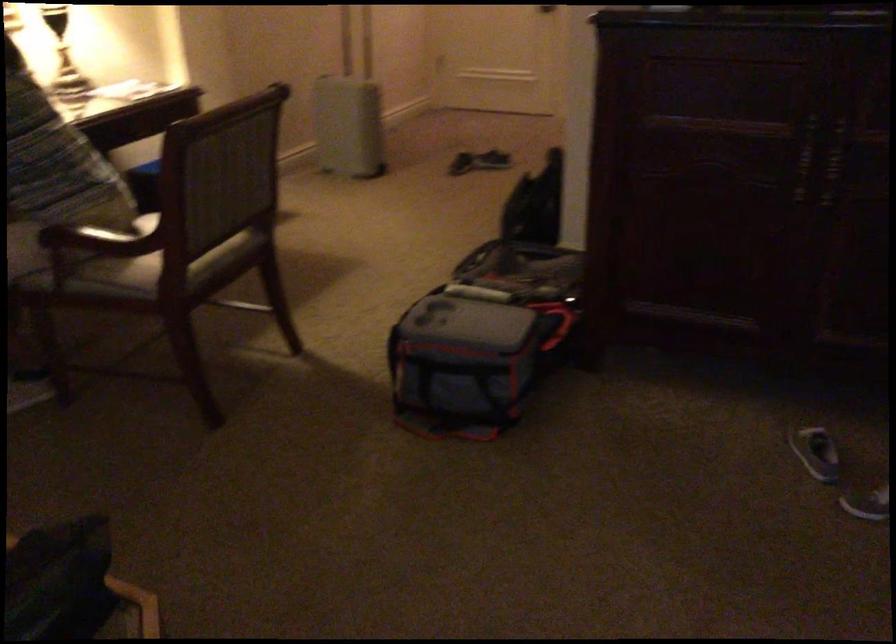
The height and width of the screenshot is (644, 896). What do you see at coordinates (558, 328) in the screenshot? I see `the bag handle` at bounding box center [558, 328].